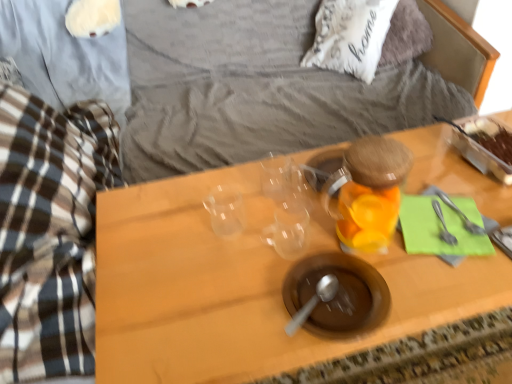
Identify the location of vacant area in front of silver metallic fork at right, which ranks as the 1th silverware in left-to-right order. The width and height of the screenshot is (512, 384). (451, 274).